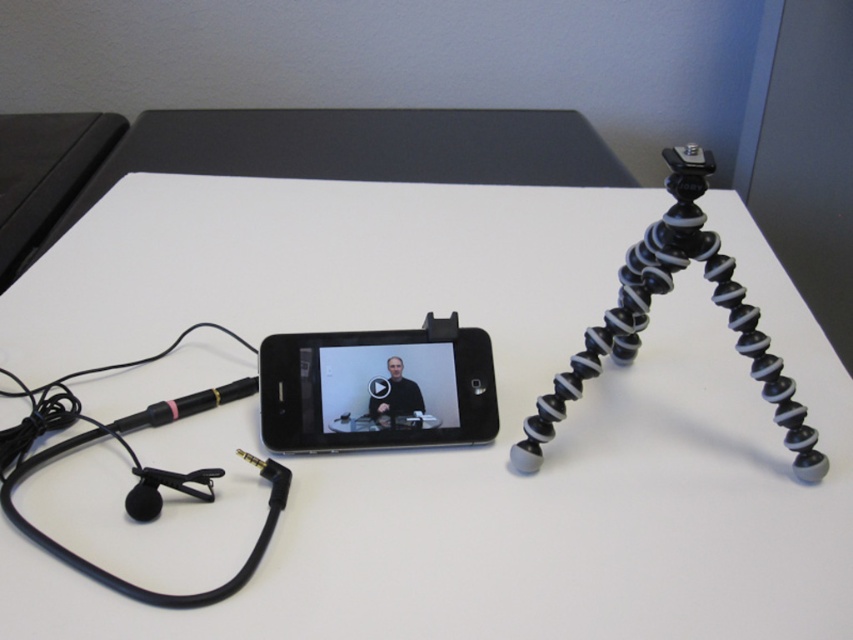
Between black rubberized tripod at right and black matte video player at center, which one is positioned higher?

black rubberized tripod at right is above.

Between black rubberized tripod at right and black matte video player at center, which one appears on the right side from the viewer's perspective?

Positioned to the right is black rubberized tripod at right.

This screenshot has width=853, height=640. In order to click on black rubberized tripod at right in this screenshot , I will do `click(664, 292)`.

Is point (363, 388) positioned after point (659, 227)?

Yes, point (363, 388) is farther from viewer.

Between black matte smartphone at center and black rubberized tripod at right, which one appears on the right side from the viewer's perspective?

black rubberized tripod at right is more to the right.

The width and height of the screenshot is (853, 640). I want to click on black matte smartphone at center, so click(x=376, y=388).

Based on the photo, can you confirm if black matte smartphone at center is positioned to the right of black matte video player at center?

Incorrect, black matte smartphone at center is not on the right side of black matte video player at center.

Which is above, black matte smartphone at center or black matte video player at center?

black matte smartphone at center is higher up.

Identify the location of black matte smartphone at center. This screenshot has width=853, height=640. (376, 388).